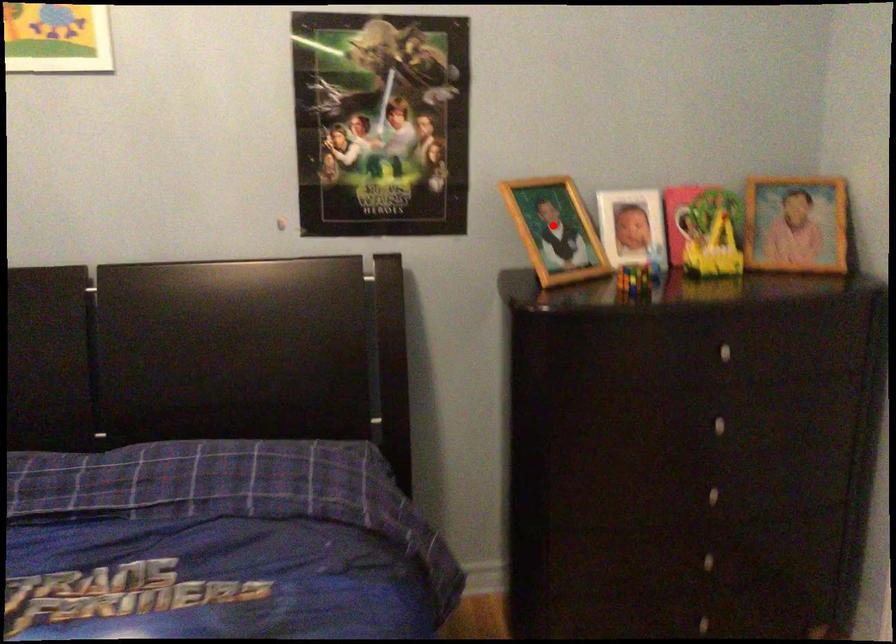
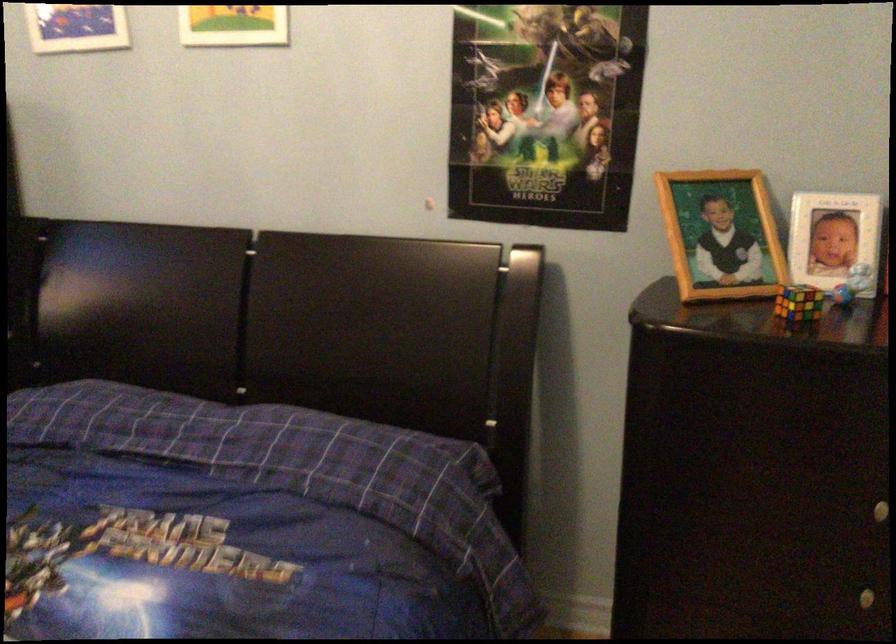
Question: I am providing you with two images of the same scene from different viewpoints. Image1 has a red point marked. In image2, the corresponding 3D location appears at what relative position? Reply with the corresponding letter.

Choices:
 (A) Closer
 (B) Farther

Answer: (A)